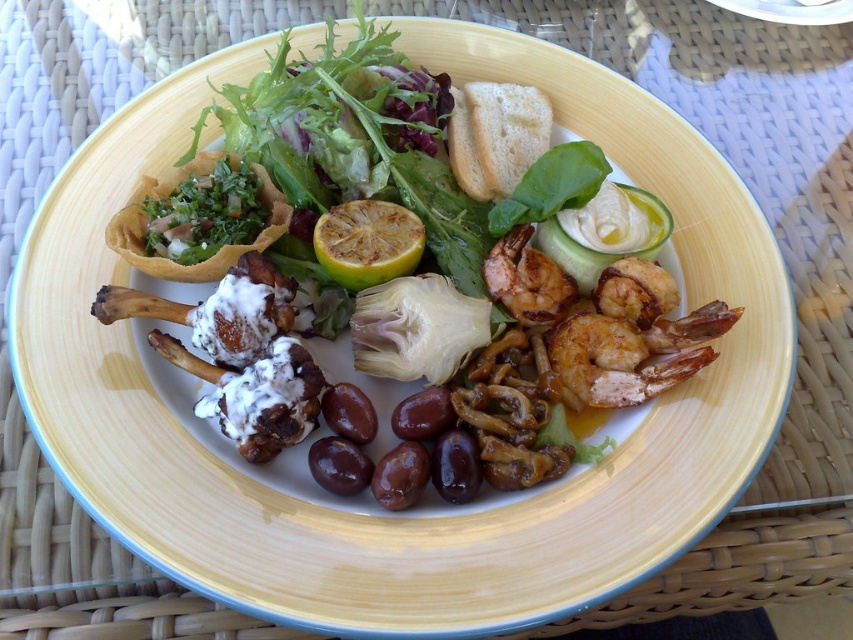
You are a food critic examining the Mediterranean platter. You notice the yellow juicy lemon at center and the grilled shrimp at center. Which of these two items is positioned closer to you?

The yellow juicy lemon at center is closer to the viewer than the grilled shrimp at center.

You are a food stylist arranging a Mediterranean platter. You have a yellow juicy lemon at center and grilled shrimp at center. Which object is wider?

The yellow juicy lemon at center might be wider than grilled shrimp at center according to the description.